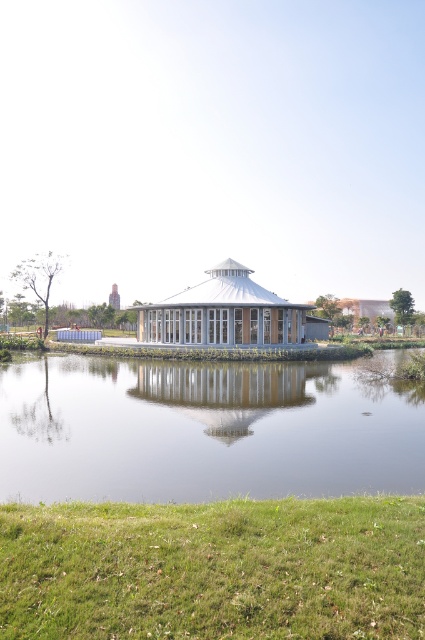
Does green grass at lower center have a smaller size compared to white glass gazebo at center?

Indeed, green grass at lower center has a smaller size compared to white glass gazebo at center.

Who is more distant from viewer, (237, 564) or (175, 324)?

Point (175, 324)

Between point (178, 512) and point (215, 273), which one is positioned behind?

The point (215, 273) is more distant.

Where is `green grass at lower center`? green grass at lower center is located at coordinates click(x=214, y=570).

Can you confirm if green grass at lower center is taller than transparent glass pond at center?

No, green grass at lower center is not taller than transparent glass pond at center.

Is point (149, 621) farther from camera compared to point (379, 449)?

No, it is not.

Locate an element on the screen. The image size is (425, 640). green grass at lower center is located at coordinates (214, 570).

Measure the distance between transparent glass pond at center and white glass gazebo at center.

Result: A distance of 66.58 feet exists between transparent glass pond at center and white glass gazebo at center.

Which is below, transparent glass pond at center or white glass gazebo at center?

transparent glass pond at center is lower down.

Which is in front, point (422, 404) or point (226, 272)?

Point (422, 404)

The height and width of the screenshot is (640, 425). Find the location of `transparent glass pond at center`. transparent glass pond at center is located at coordinates (206, 429).